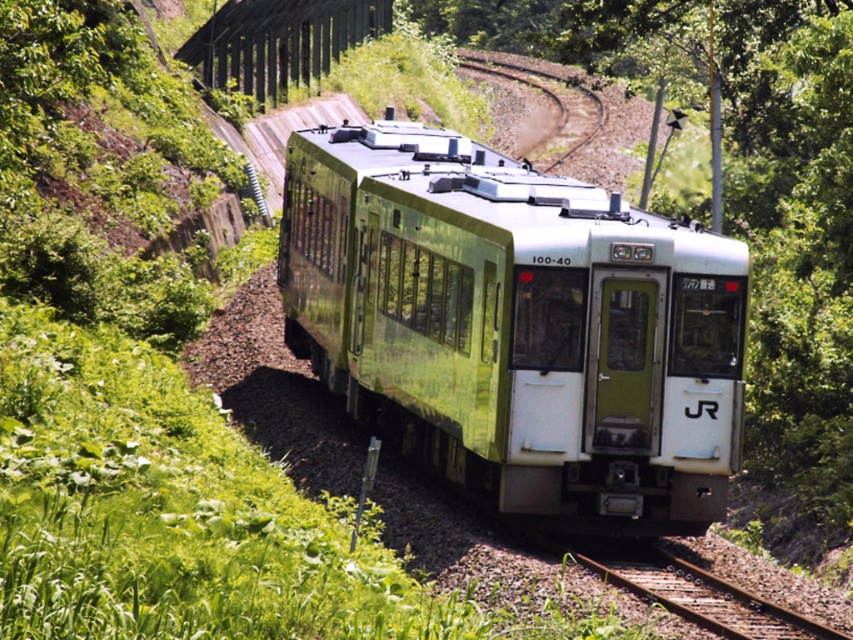
Question: Among these points, which one is farthest from the camera?

Choices:
 (A) (677, 570)
 (B) (670, 344)
 (C) (560, 106)

Answer: (C)

Question: Which is farther from the green metallic track at center?

Choices:
 (A) green metallic train at center
 (B) rusty metal track at center

Answer: (B)

Question: Does rusty metal track at center have a greater width compared to green metallic track at center?

Choices:
 (A) yes
 (B) no

Answer: (B)

Question: Does green metallic train at center have a lesser width compared to green metallic track at center?

Choices:
 (A) no
 (B) yes

Answer: (B)

Question: Does green metallic train at center lie behind rusty metal track at center?

Choices:
 (A) yes
 (B) no

Answer: (A)

Question: Which point is closer to the camera taking this photo?

Choices:
 (A) (718, 634)
 (B) (550, 74)
 (C) (708, 516)

Answer: (A)